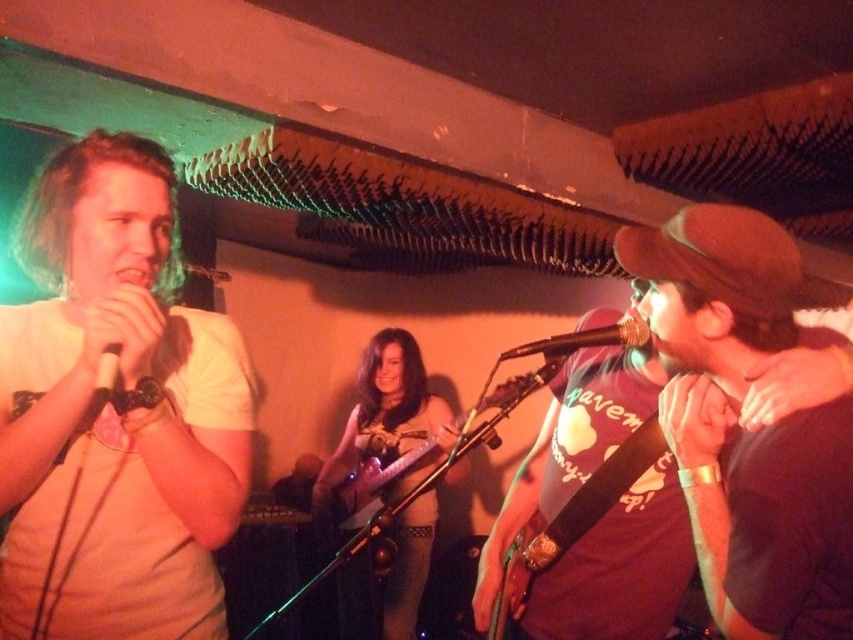
Question: Among these objects, which one is farthest from the camera?

Choices:
 (A) leather-like brown guitar at center
 (B) brown fabric cap at upper right

Answer: (A)

Question: Which point is farther from the camera taking this photo?

Choices:
 (A) (605, 330)
 (B) (395, 566)
 (C) (358, 500)
 (D) (753, 392)

Answer: (B)

Question: Can you confirm if wooden acoustic guitar at center is positioned to the right of metallic silver microphone at center?

Choices:
 (A) no
 (B) yes

Answer: (A)

Question: Which of the following is the closest to the observer?

Choices:
 (A) wooden acoustic guitar at center
 (B) metallic silver microphone at center
 (C) leather-like brown guitar at center

Answer: (B)

Question: Is leather-like brown guitar at center further to the viewer compared to metallic silver microphone at center?

Choices:
 (A) yes
 (B) no

Answer: (A)

Question: Is wooden acoustic guitar at center thinner than metallic silver microphone at center?

Choices:
 (A) no
 (B) yes

Answer: (A)